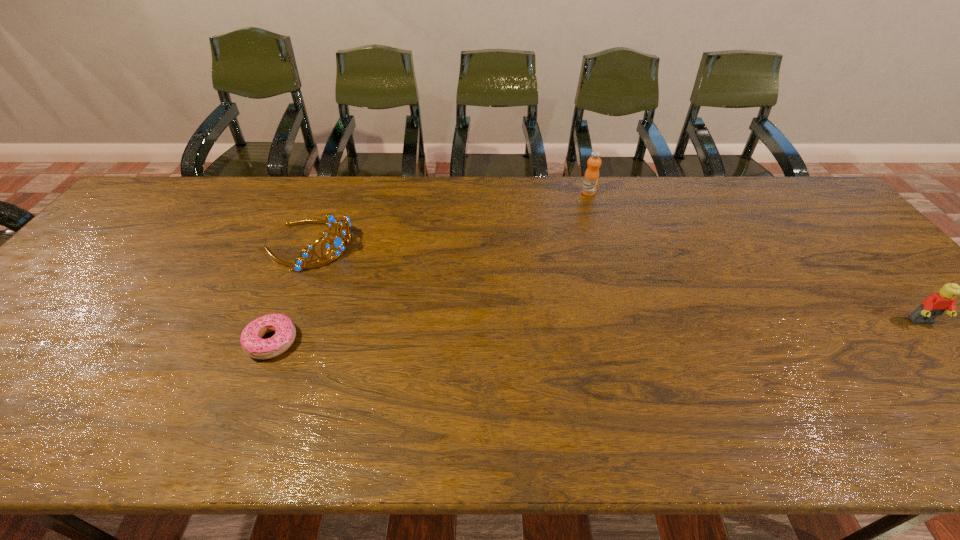
You are a GUI agent. You are given a task and a screenshot of the screen. Output one action in this format:
    pyautogui.click(x=<x>, y=<y>)
    Task: Click on the vacant area situated 0.160m on the front-facing side of the tiara
    
    Given the screenshot: What is the action you would take?
    pyautogui.click(x=388, y=278)

This screenshot has height=540, width=960. Find the location of `free space located on the front label of the second object from right to left`. free space located on the front label of the second object from right to left is located at coordinates (619, 234).

Image resolution: width=960 pixels, height=540 pixels. In order to click on vacant space located on the front label of the second object from right to left in this screenshot , I will do `click(608, 218)`.

Find the location of `blank area located 0.080m on the front label of the second object from right to left`. blank area located 0.080m on the front label of the second object from right to left is located at coordinates (602, 211).

This screenshot has height=540, width=960. Identify the location of object located in the far edge section of the desktop. (591, 177).

This screenshot has height=540, width=960. What are the coordinates of `object that is at the near edge` in the screenshot? It's located at (253, 345).

Where is `object located in the right edge section of the desktop`? Image resolution: width=960 pixels, height=540 pixels. object located in the right edge section of the desktop is located at coordinates (934, 305).

The image size is (960, 540). Find the location of `vacant region at the far edge of the desktop`. vacant region at the far edge of the desktop is located at coordinates (270, 196).

You are a GUI agent. You are given a task and a screenshot of the screen. Output one action in this format:
    pyautogui.click(x=<x>, y=<y>)
    Task: Click on the blank space at the near edge of the desktop
    The image size is (960, 540).
    Given the screenshot: What is the action you would take?
    pyautogui.click(x=873, y=387)

At what (x,y) coordinates should I click in order to perform the action: click on vacant space at the right edge. Please return your answer as a coordinate pair (x, y). This screenshot has width=960, height=540. Looking at the image, I should click on (954, 346).